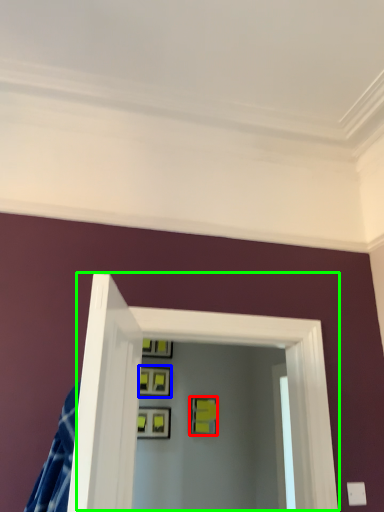
Question: Which is farther away from picture frame (highlighted by a red box)? picture frame (highlighted by a blue box) or glass door (highlighted by a green box)?

Choices:
 (A) picture frame
 (B) glass door

Answer: (B)